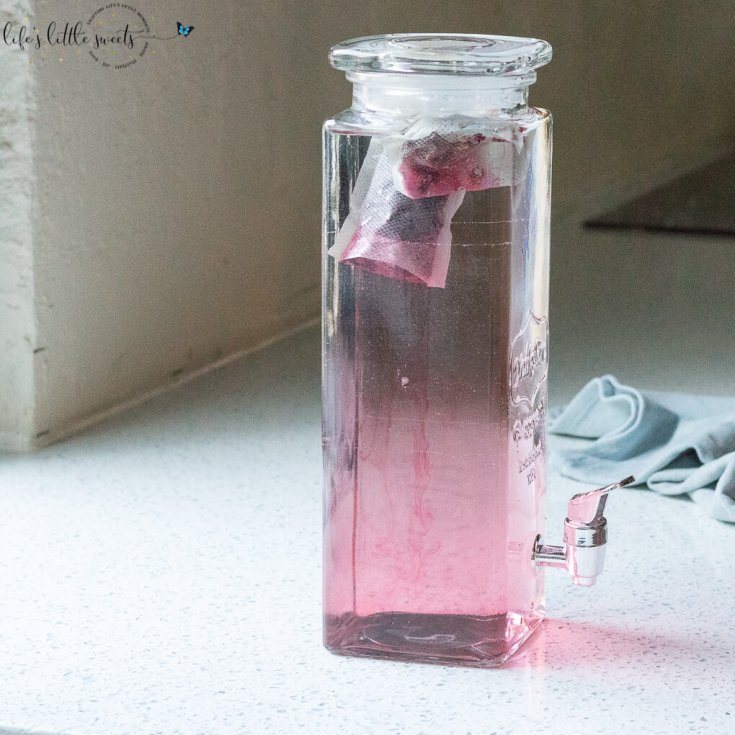
This screenshot has height=735, width=735. I want to click on tap, so click(587, 544).